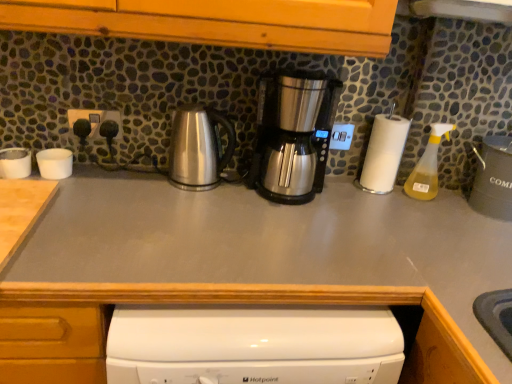
You are a GUI agent. You are given a task and a screenshot of the screen. Output one action in this format:
    pyautogui.click(x=<x>, y=<y>)
    Task: Click on the free space in front of satin silver kettle at center, which ranks as the first kitchen appliance in left-to-right order
    This screenshot has height=384, width=512.
    Given the screenshot: What is the action you would take?
    pyautogui.click(x=186, y=201)